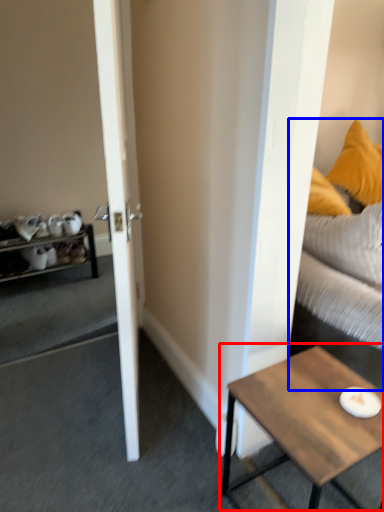
Question: Which of the following is the closest to the observer, coffee table (highlighted by a red box) or studio couch (highlighted by a blue box)?

Choices:
 (A) coffee table
 (B) studio couch

Answer: (A)